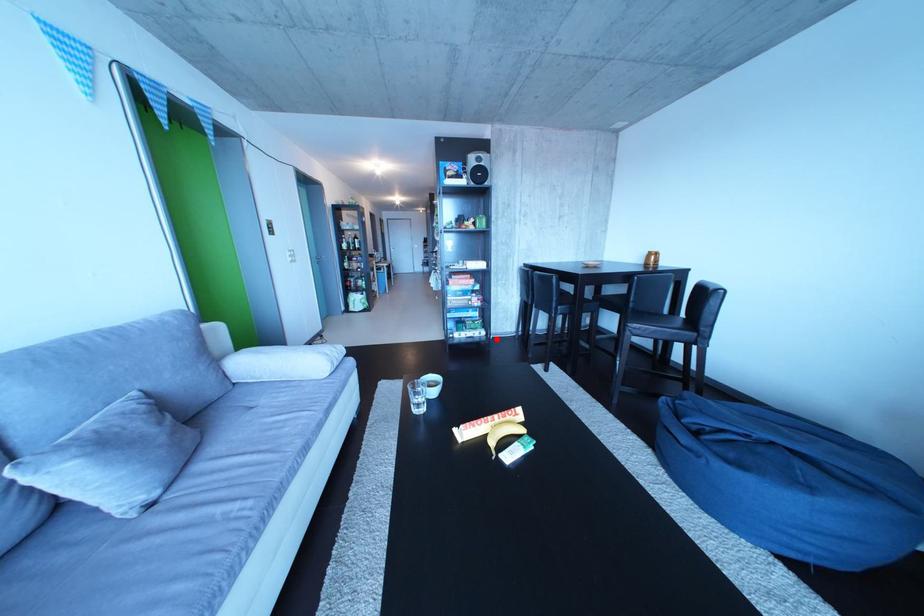
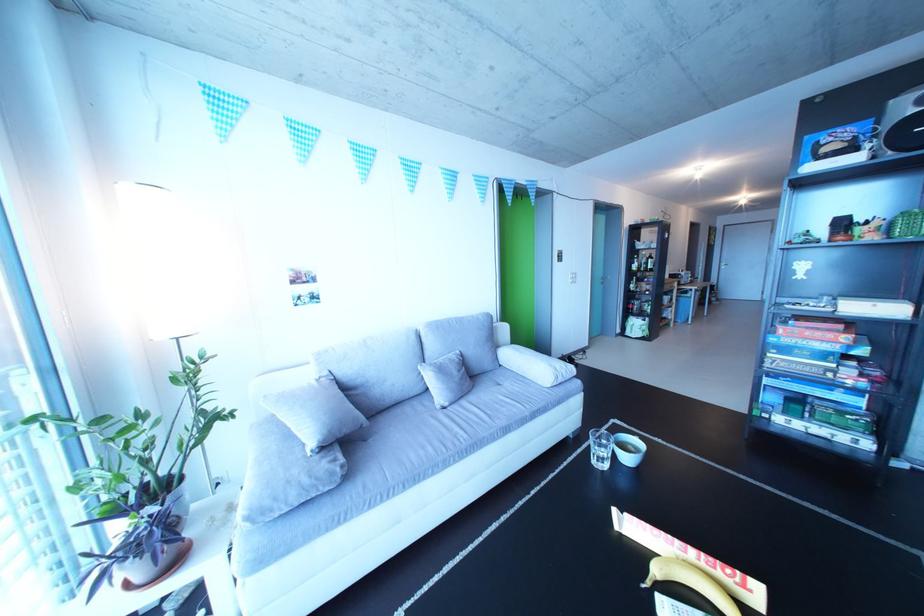
Find the pixel in the second image that matches the highlighted location in the first image.

(881, 451)